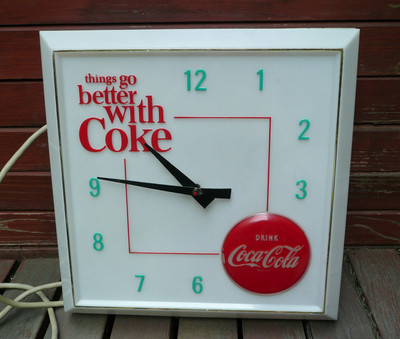
What are the coordinates of `electrical cord` in the screenshot? It's located at (41, 306), (16, 150).